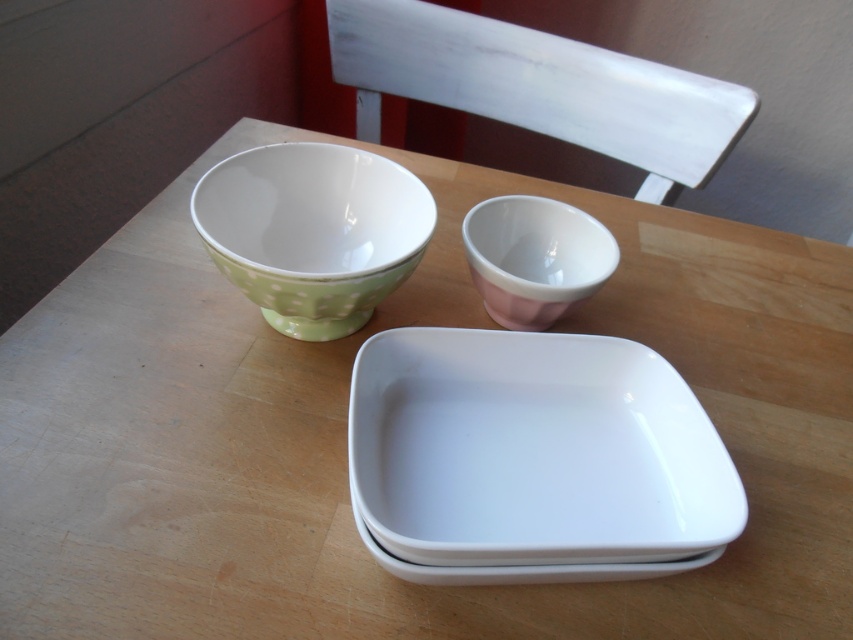
Does white glossy tray at center have a lesser width compared to pink glossy cup at upper center?

In fact, white glossy tray at center might be wider than pink glossy cup at upper center.

Is white glossy tray at center to the right of pink glossy cup at upper center from the viewer's perspective?

In fact, white glossy tray at center is to the left of pink glossy cup at upper center.

Image resolution: width=853 pixels, height=640 pixels. What are the coordinates of `white glossy tray at center` in the screenshot? It's located at (532, 452).

Who is more distant from viewer, (494, 493) or (260, 300)?

Positioned behind is point (260, 300).

I want to click on white glossy tray at center, so click(532, 452).

Is point (627, 493) positioned before point (393, 253)?

Yes, point (627, 493) is closer to viewer.

Locate an element on the screen. This screenshot has width=853, height=640. white glossy tray at center is located at coordinates (532, 452).

Locate an element on the screen. The width and height of the screenshot is (853, 640). green polka dot porcelain bowl at upper left is located at coordinates coord(312,230).

Between green polka dot porcelain bowl at upper left and pink glossy cup at upper center, which one appears on the right side from the viewer's perspective?

pink glossy cup at upper center

What do you see at coordinates (312, 230) in the screenshot? I see `green polka dot porcelain bowl at upper left` at bounding box center [312, 230].

Find the location of a particular element. This screenshot has width=853, height=640. green polka dot porcelain bowl at upper left is located at coordinates click(x=312, y=230).